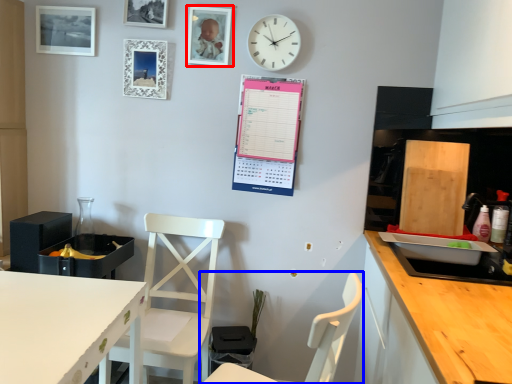
Question: Among these objects, which one is farthest to the camera, picture frame (highlighted by a red box) or chair (highlighted by a blue box)?

Choices:
 (A) picture frame
 (B) chair

Answer: (A)